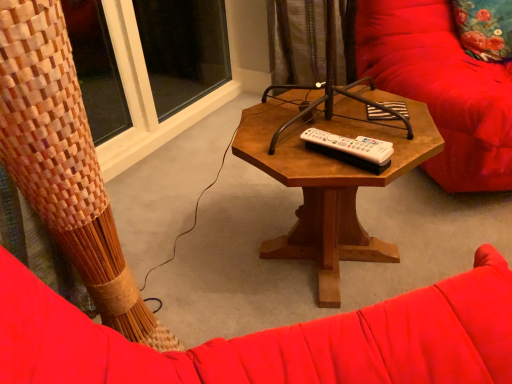
Where is `woodenobject at center`? The image size is (512, 384). woodenobject at center is located at coordinates (330, 179).

Measure the distance between white plastic remote at center and camera.

white plastic remote at center and camera are 35.08 inches apart from each other.

This screenshot has height=384, width=512. What do you see at coordinates (441, 88) in the screenshot? I see `velvet red swivel chair at right` at bounding box center [441, 88].

Locate an element on the screen. woodenobject at center is located at coordinates (330, 179).

Find the location of a particular element. coffee table that is under the transparent glass window at upper left (from a real-world perspective) is located at coordinates (330, 179).

Considering the sizes of objects woodenobject at center and transparent glass window at upper left in the image provided, who is thinner, woodenobject at center or transparent glass window at upper left?

transparent glass window at upper left is thinner.

From a real-world perspective, which is physically below, woodenobject at center or transparent glass window at upper left?

woodenobject at center.

Who is taller, woodenobject at center or transparent glass window at upper left?

transparent glass window at upper left is taller.

From a real-world perspective, is woven wood curtain at upper left above or below floral fabric pillow at upper right?

Clearly, from a real-world perspective, woven wood curtain at upper left is above floral fabric pillow at upper right.

Considering the positions of objects woven wood curtain at upper left and floral fabric pillow at upper right in the image provided, who is behind, woven wood curtain at upper left or floral fabric pillow at upper right?

floral fabric pillow at upper right is further from the camera.

Which of these two, woven wood curtain at upper left or floral fabric pillow at upper right, stands shorter?

floral fabric pillow at upper right is shorter.

Which object is wider, woven wood curtain at upper left or floral fabric pillow at upper right?

Wider between the two is woven wood curtain at upper left.

Consider the image. From the image's perspective, who appears lower, woven wood curtain at upper left or velvet red swivel chair at right?

woven wood curtain at upper left is shown below in the image.

Can you tell me how much woven wood curtain at upper left and velvet red swivel chair at right differ in facing direction?

The facing directions of woven wood curtain at upper left and velvet red swivel chair at right are 91.1 degrees apart.

Is woven wood curtain at upper left shorter than velvet red swivel chair at right?

Incorrect, the height of woven wood curtain at upper left does not fall short of that of velvet red swivel chair at right.

Who is bigger, white plastic remote at center or woven wood curtain at upper left?

Bigger between the two is woven wood curtain at upper left.

Is white plastic remote at center shorter than woven wood curtain at upper left?

Yes.

How far apart are white plastic remote at center and woven wood curtain at upper left?

The distance of white plastic remote at center from woven wood curtain at upper left is 54.96 centimeters.

Which is behind, point (342, 144) or point (93, 167)?

The point (342, 144) is farther from the camera.

Would you say transparent glass window at upper left is part of white plastic remote at center's contents?

No, white plastic remote at center does not contain transparent glass window at upper left.

In the scene shown: Looking at the image, does white plastic remote at center seem bigger or smaller compared to transparent glass window at upper left?

Considering their sizes, white plastic remote at center takes up less space than transparent glass window at upper left.

Identify the location of window behind the white plastic remote at center. This screenshot has height=384, width=512. (183, 50).

From the image's perspective, relative to transparent glass window at upper left, is white plastic remote at center above or below?

white plastic remote at center is situated lower than transparent glass window at upper left in the image.

Based on the photo, is transparent glass window at upper left surrounding white plastic remote at center?

No, white plastic remote at center is not a part of transparent glass window at upper left.

Does transparent glass window at upper left lie behind white plastic remote at center?

Yes, transparent glass window at upper left is behind white plastic remote at center.

From the picture: From a real-world perspective, is transparent glass window at upper left positioned above or below white plastic remote at center?

From a real-world perspective, transparent glass window at upper left is physically below white plastic remote at center.

From the image's perspective, which one is positioned higher, transparent glass window at upper left or white plastic remote at center?

transparent glass window at upper left, from the image's perspective.

Is transparent glass window at upper left looking in the opposite direction of floral fabric pillow at upper right?

No, floral fabric pillow at upper right is not at the back of transparent glass window at upper left.

Which is more to the left, transparent glass window at upper left or floral fabric pillow at upper right?

Positioned to the left is transparent glass window at upper left.

Identify the location of window above the woodenobject at center (from a real-world perspective). (183, 50).

Where is `throw pillow to the right of woven wood curtain at upper left`? throw pillow to the right of woven wood curtain at upper left is located at coordinates (484, 28).

Estimate the real-world distances between objects in this image. Which object is closer to velvet red swivel chair at right, transparent glass window at upper left or white plastic remote at center?

Based on the image, white plastic remote at center appears to be nearer to velvet red swivel chair at right.

When comparing their distances from velvet red swivel chair at right, does woodenobject at center or white plastic remote at center seem closer?

woodenobject at center is closer to velvet red swivel chair at right.

Based on the photo, when comparing their distances from woven wood curtain at upper left, does floral fabric pillow at upper right or transparent glass window at upper left seem closer?

floral fabric pillow at upper right lies closer to woven wood curtain at upper left than the other object.

Estimate the real-world distances between objects in this image. Which object is closer to white plastic remote at center, transparent glass window at upper left or woven wood curtain at upper left?

Based on the image, woven wood curtain at upper left appears to be nearer to white plastic remote at center.

When comparing their distances from floral fabric pillow at upper right, does woven wood curtain at upper left or velvet red swivel chair at right seem further?

woven wood curtain at upper left is positioned further to the anchor floral fabric pillow at upper right.

Estimate the real-world distances between objects in this image. Which object is further from white plastic remote at center, velvet red swivel chair at right or transparent glass window at upper left?

transparent glass window at upper left lies further to white plastic remote at center than the other object.

Consider the image. When comparing their distances from velvet red swivel chair at right, does floral fabric pillow at upper right or transparent glass window at upper left seem further?

Based on the image, transparent glass window at upper left appears to be further to velvet red swivel chair at right.

Considering their positions, is floral fabric pillow at upper right positioned closer to woodenobject at center than woven wood curtain at upper left?

woven wood curtain at upper left is closer to woodenobject at center.

The width and height of the screenshot is (512, 384). Find the location of `remote located between woodenobject at center and transparent glass window at upper left in the depth direction`. remote located between woodenobject at center and transparent glass window at upper left in the depth direction is located at coordinates click(x=351, y=147).

The width and height of the screenshot is (512, 384). In order to click on remote located between woven wood curtain at upper left and woodenobject at center in the left-right direction in this screenshot , I will do 351,147.

Locate an element on the screen. This screenshot has height=384, width=512. remote positioned between woven wood curtain at upper left and transparent glass window at upper left from near to far is located at coordinates (351, 147).

Locate an element on the screen. coffee table between woven wood curtain at upper left and velvet red swivel chair at right from left to right is located at coordinates (330, 179).